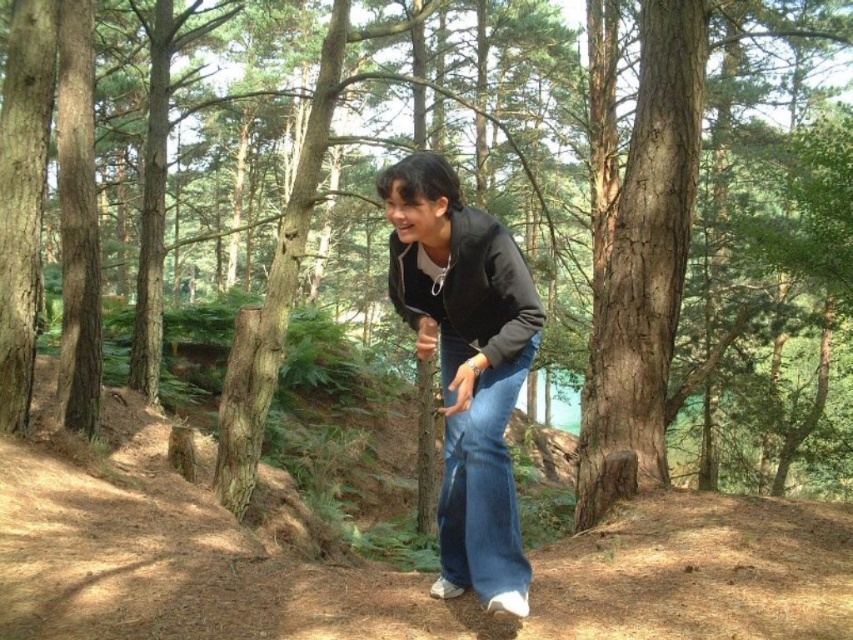
You are a photographer wanting to capture a photo of the matte black jacket at center. Your camera is 9.30 feet away from the jacket. Is this distance within the recommended 10 feet range for clear focus?

The distance between the matte black jacket at center and the camera is 9.30 feet, which is within the recommended 10 feet range for clear focus.

Looking at this image, you are a fashion designer observing the person in the forest. You need to determine if the matte black jacket at center can be folded and stored inside the denim at center. Based on their sizes, what do you conclude?

The matte black jacket at center has a larger width than the denim at center, so it cannot be folded and stored inside the denim at center due to its larger size.

You are a photographer trying to capture the person in the forest. You want to focus on the matte black jacket at center and denim at center. Which object should you adjust your camera focus on first if you want to ensure both are in focus?

The matte black jacket at center is closer to the viewer than denim at center. To ensure both are in focus, you should focus on the matte black jacket at center first because it is closer, and then adjust for the denim at center.